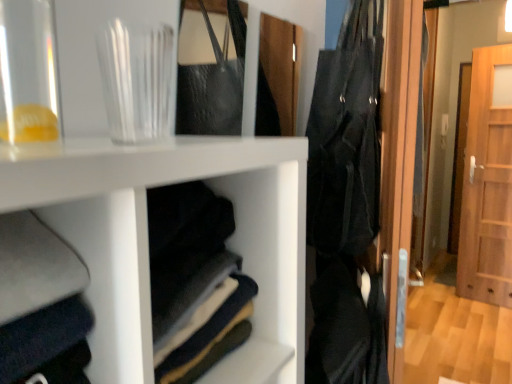
Question: In terms of size, does wooden door at right appear bigger or smaller than transparent glass jar at upper left, the first glass vase in the left-to-right sequence?

Choices:
 (A) big
 (B) small

Answer: (A)

Question: From a real-world perspective, is wooden door at right positioned above or below transparent glass jar at upper left, which ranks as the 2th glass vase in back-to-front order?

Choices:
 (A) above
 (B) below

Answer: (B)

Question: Which of these objects is positioned farthest from the transparent glass jar at upper left, the 2th glass vase from the right?

Choices:
 (A) black fabric bag at right
 (B) transparent glass at upper left, marked as the first glass vase in a right-to-left arrangement
 (C) wooden door at right

Answer: (C)

Question: Which is nearer to the transparent glass jar at upper left, which ranks as the 2th glass vase in back-to-front order?

Choices:
 (A) wooden door at right
 (B) transparent glass at upper left, arranged as the second glass vase when viewed from the left
 (C) black fabric bag at right

Answer: (B)